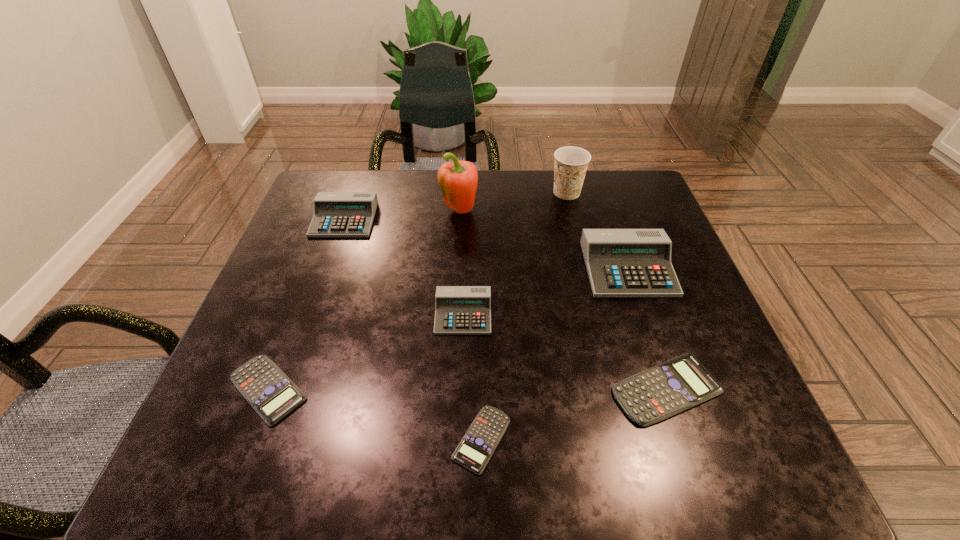
Where is `calculator that stands as the second closest to the fourth shortest calculator`? The width and height of the screenshot is (960, 540). calculator that stands as the second closest to the fourth shortest calculator is located at coordinates (665, 390).

At what (x,y) coordinates should I click in order to perform the action: click on gray calculator object that ranks as the second closest to the tallest calculator. Please return your answer as a coordinate pair (x, y). This screenshot has height=540, width=960. Looking at the image, I should click on (336, 214).

Locate which gray calculator ranks second in proximity to the farthest calculator. Please provide its 2D coordinates. Your answer should be formatted as a tuple, i.e. [(x, y)], where the tuple contains the x and y coordinates of a point satisfying the conditions above.

[(620, 262)]

You are a GUI agent. You are given a task and a screenshot of the screen. Output one action in this format:
    pyautogui.click(x=<x>, y=<y>)
    Task: Click on the blue calculator that is the second closest to the tallest object
    
    Given the screenshot: What is the action you would take?
    pyautogui.click(x=665, y=390)

At what (x,y) coordinates should I click in order to perform the action: click on blue calculator identified as the closest to the tallest calculator. Please return your answer as a coordinate pair (x, y). Looking at the image, I should click on (665, 390).

This screenshot has height=540, width=960. I want to click on vacant region that satisfies the following two spatial constraints: 1. on the back side of the second shortest calculator; 2. on the left side of the second smallest gray calculator, so click(x=333, y=220).

Image resolution: width=960 pixels, height=540 pixels. I want to click on vacant space that satisfies the following two spatial constraints: 1. on the front side of the seventh shortest object; 2. on the right side of the biggest blue calculator, so click(x=614, y=389).

Where is `free region that satisfies the following two spatial constraints: 1. on the front side of the Dixie cup; 2. on the left side of the fourth tallest calculator`? free region that satisfies the following two spatial constraints: 1. on the front side of the Dixie cup; 2. on the left side of the fourth tallest calculator is located at coordinates (614, 389).